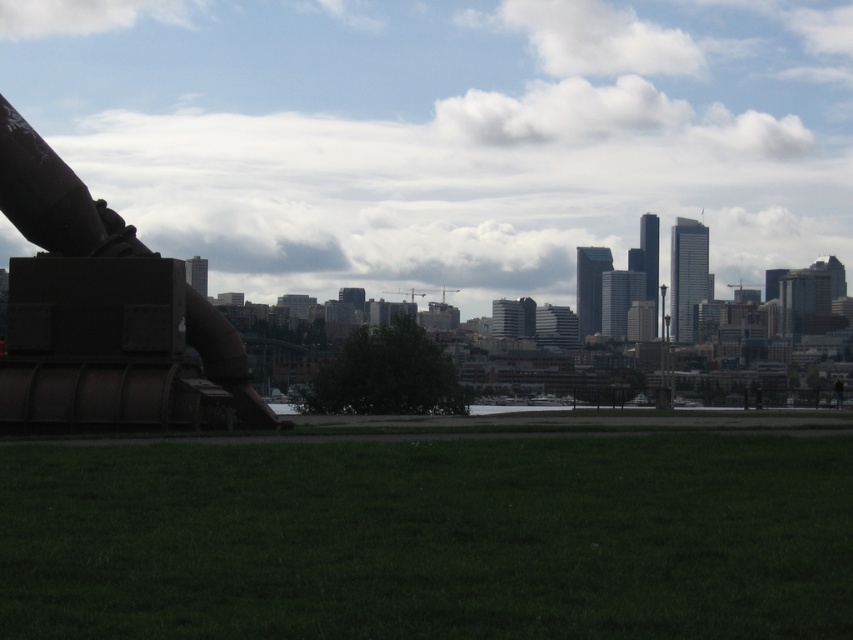
You are standing in the park and want to take a photo of the city skyline. You have a camera that can focus on objects up to 5 meters away. Is the green grass at lower center within the camera focus range?

The green grass at lower center is 7.00 meters away from the camera, which is beyond the camera focus range of 5 meters. Therefore, the camera cannot focus on the green grass at lower center.

You are a gardener who needs to mow the green grass at lower center and move the rusty metal cannon at left. Considering their sizes, which task would require more time and effort?

The green grass at lower center has a larger size compared to the rusty metal cannon at left, so mowing the green grass at lower center would require more time and effort due to its bigger area.